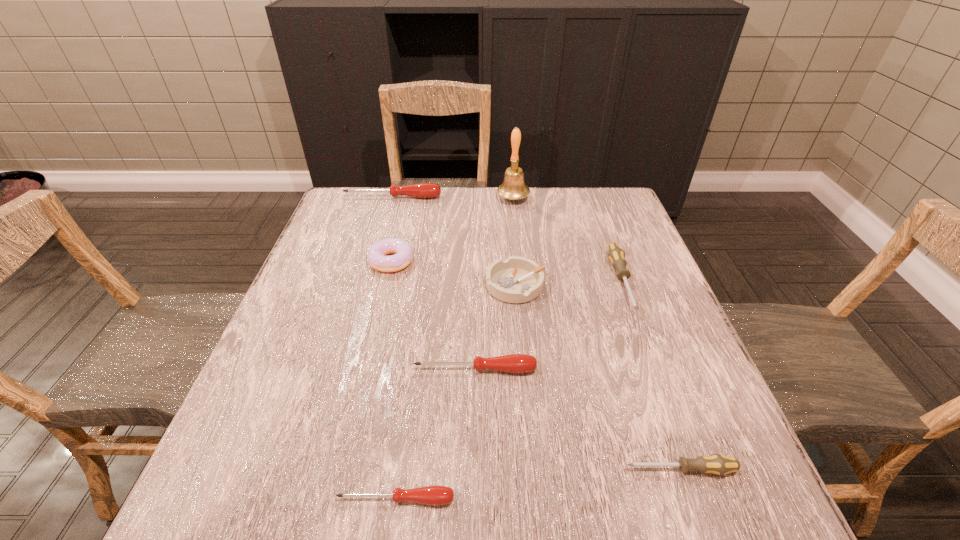
Point out which red screwdriver is positioned as the second nearest to the second biggest red screwdriver. Please provide its 2D coordinates. Your answer should be formatted as a tuple, i.e. [(x, y)], where the tuple contains the x and y coordinates of a point satisfying the conditions above.

[(422, 190)]

Identify which red screwdriver is located as the third nearest to the tallest object. Please provide its 2D coordinates. Your answer should be formatted as a tuple, i.e. [(x, y)], where the tuple contains the x and y coordinates of a point satisfying the conditions above.

[(435, 495)]

The width and height of the screenshot is (960, 540). What are the coordinates of `vacant point that satisfies the following two spatial constraints: 1. on the front side of the second nearest red screwdriver; 2. on the left side of the doughnut` in the screenshot? It's located at (366, 369).